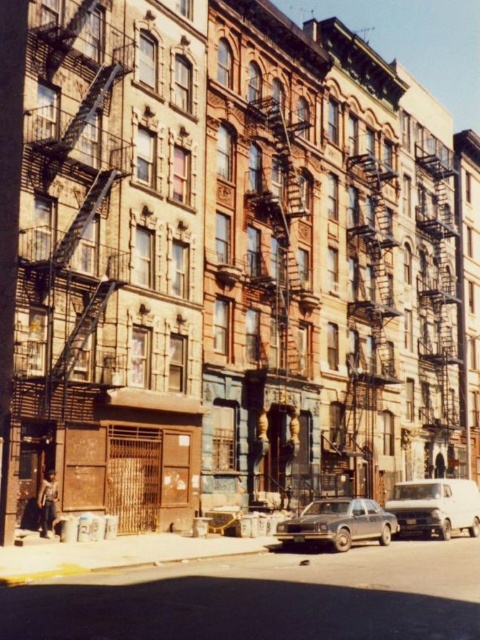
You are standing at the corner of the street and want to locate the rusty metal fire escape at center. According to the coordinates provided, where should you look?

The rusty metal fire escape at center is located at coordinates point (282,300).

You are a delivery person trying to park your matte gray sedan at center in a narrow alley between two buildings. There is a rusty metal fire escape at center blocking the path. Can you fit your sedan between the fire escape and the building wall?

The rusty metal fire escape at center is to the left of matte gray sedan at center, so there is space between them. However, since the alley is narrow and the fire escape is positioned to the left of the sedan, it might not leave enough clearance for the sedan to safely maneuver around the fire escape and park without hitting the building wall.